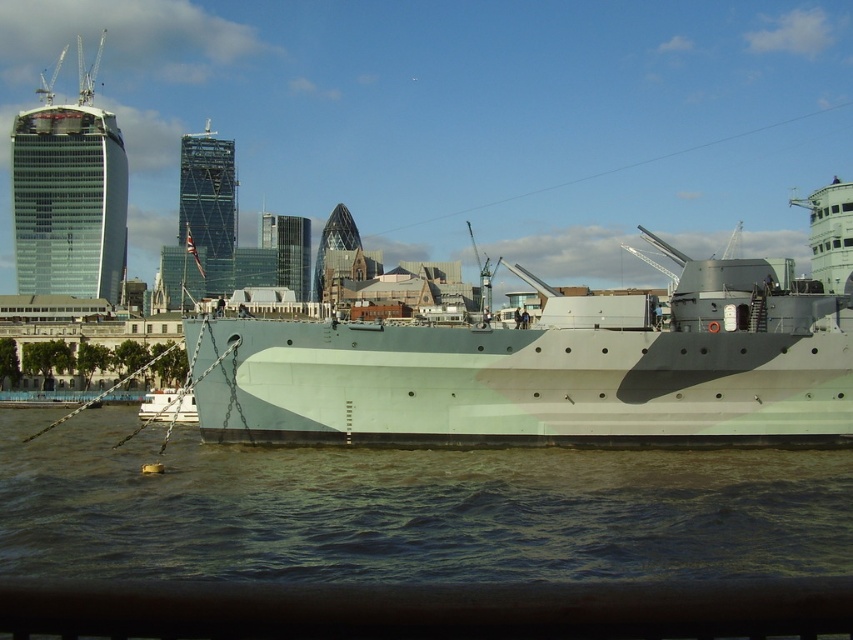
You are standing on the dock and looking at the greenish water at lower center and the white matte boat at lower left. Which object appears taller from your viewpoint?

The white matte boat at lower left appears taller than the greenish water at lower center.

You are a tour guide explaining the naval ship to visitors. You mention that the white matte boat at lower left is anchored to the greenish water at lower center. How far apart are these two objects?

The distance between the greenish water at lower center and the white matte boat at lower left is 27.73 meters.